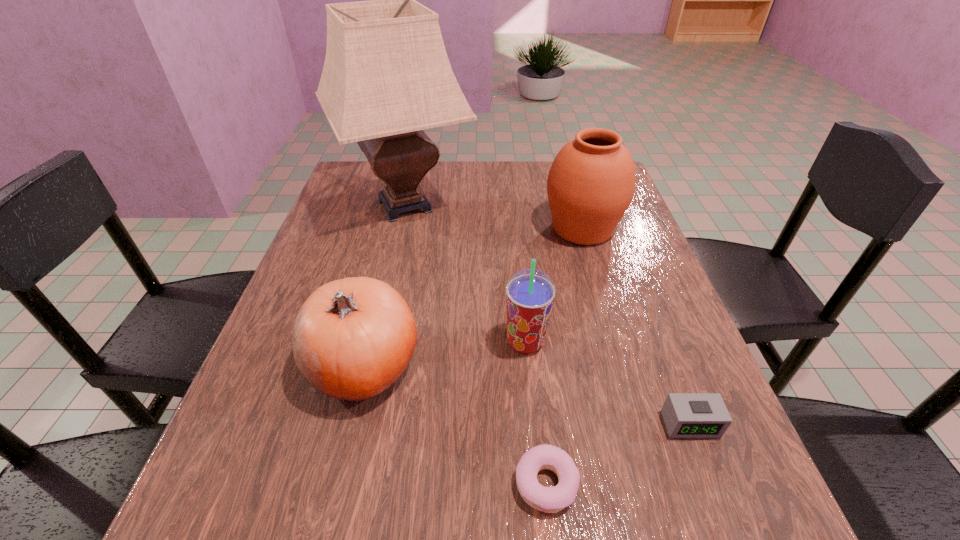
Where is `vacant space at the far edge of the desktop`? vacant space at the far edge of the desktop is located at coordinates (487, 180).

In the image, there is a desktop. Identify the location of vacant area at the left edge. (252, 395).

Where is `free location at the right edge`? This screenshot has width=960, height=540. free location at the right edge is located at coordinates (708, 388).

The height and width of the screenshot is (540, 960). Find the location of `blank area at the far left corner`. blank area at the far left corner is located at coordinates (361, 190).

Image resolution: width=960 pixels, height=540 pixels. Identify the location of unoccupied position between the pumpkin and the alarm clock. click(x=526, y=394).

Identify the location of vacant space in between the nearest object and the second tallest object. This screenshot has width=960, height=540. (564, 356).

Where is `empty space that is in between the urn and the fifth tallest object`? Image resolution: width=960 pixels, height=540 pixels. empty space that is in between the urn and the fifth tallest object is located at coordinates (636, 326).

You are a GUI agent. You are given a task and a screenshot of the screen. Output one action in this format:
    pyautogui.click(x=<x>, y=<y>)
    Task: Click on the empty space between the fifth shortest object and the tallest object
    
    Given the screenshot: What is the action you would take?
    pyautogui.click(x=493, y=217)

Identify the location of vacant area that lies between the fifth shortest object and the second shortest object. The image size is (960, 540). (636, 326).

Identify the location of empty location between the urn and the doughnut. (564, 356).